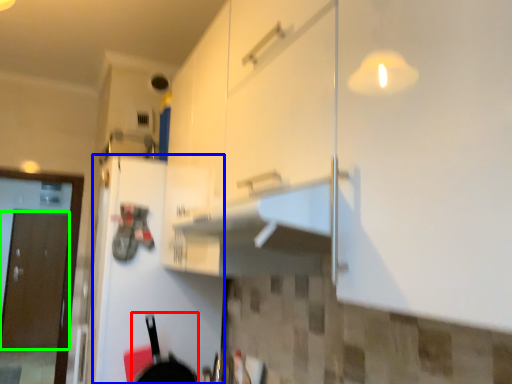
Question: Estimate the real-world distances between objects in this image. Which object is closer to frying pan (highlighted by a red box), door (highlighted by a blue box) or door (highlighted by a green box)?

Choices:
 (A) door
 (B) door

Answer: (A)